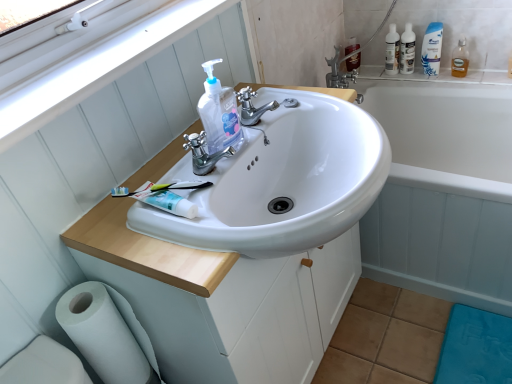
Image resolution: width=512 pixels, height=384 pixels. What are the coordinates of `vacant area that is in front of white glossy toothpaste at center` in the screenshot? It's located at (173, 245).